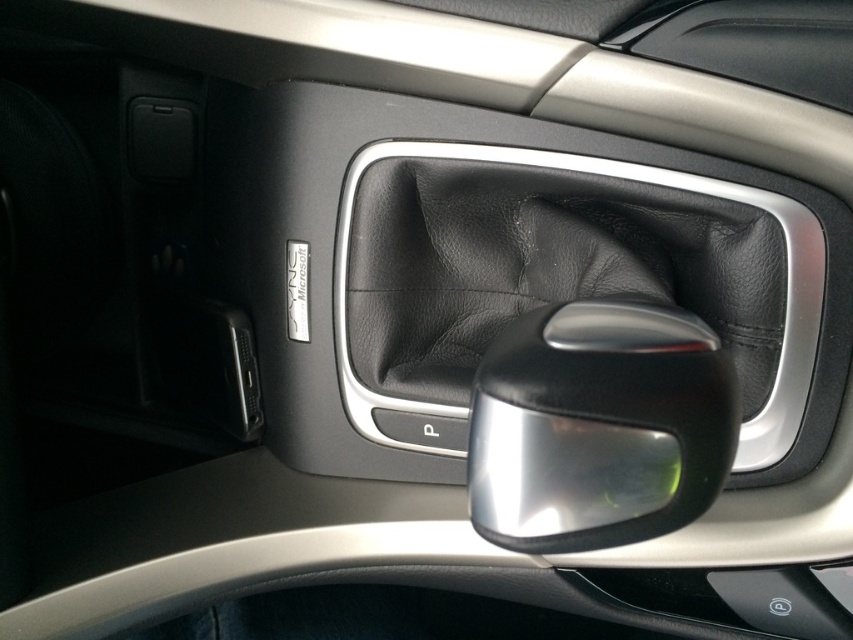
You are a car mechanic checking the driver side door panel. You need to reach the point at coordinates point [757,240]. Your hand is 10 inches long. Can you reach it?

The distance between point [757,240] and the viewer is 22.69 inches. Since your hand is only 10 inches long, you cannot reach it.

Consider the image. You are a passenger in the car and want to press the button labeled with the letter. You see two points, point (459,273) and point (602,337). Which point is closer to you?

Point (602,337) is closer to you because it is less further to the camera than point (459,273).